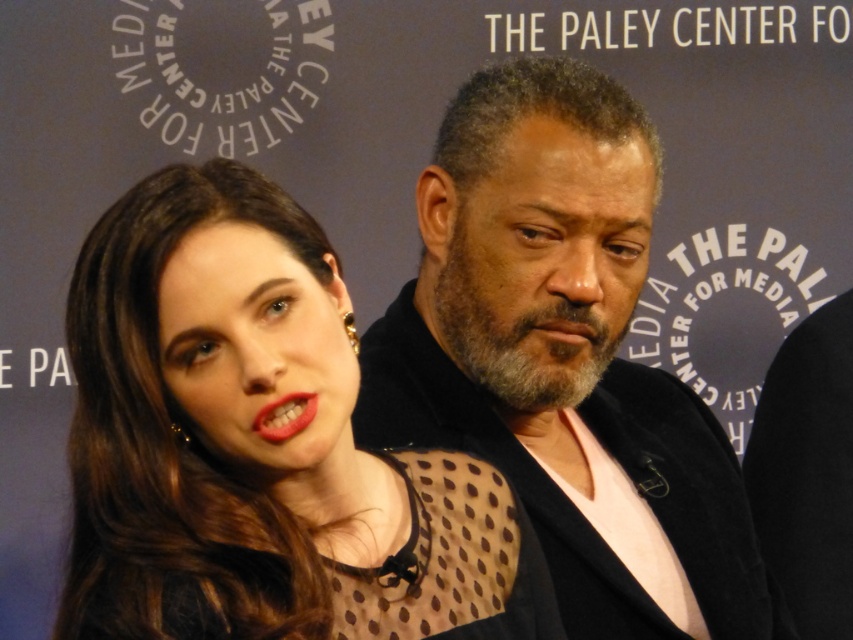
Question: Which of the following is the farthest from the observer?

Choices:
 (A) (506, 380)
 (B) (113, 524)

Answer: (A)

Question: Which point is farther to the camera?

Choices:
 (A) (223, 481)
 (B) (635, 364)

Answer: (B)

Question: Which of the following is the farthest from the observer?

Choices:
 (A) matte black dress at center
 (B) dark brown textured jacket at center

Answer: (B)

Question: Is matte black dress at center positioned at the back of dark brown textured jacket at center?

Choices:
 (A) yes
 (B) no

Answer: (B)

Question: Observing the image, what is the correct spatial positioning of matte black dress at center in reference to dark brown textured jacket at center?

Choices:
 (A) right
 (B) left

Answer: (B)

Question: Is the position of matte black dress at center more distant than that of dark brown textured jacket at center?

Choices:
 (A) no
 (B) yes

Answer: (A)